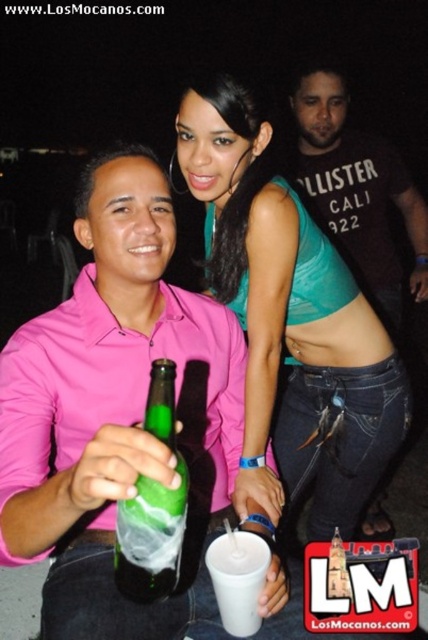
Question: Which point is closer to the camera?

Choices:
 (A) (71, 445)
 (B) (229, 529)
 (C) (163, 531)
 (D) (264, 220)

Answer: (C)

Question: Is matte green glass bottle at center smaller than green glass bottle at center?

Choices:
 (A) no
 (B) yes

Answer: (A)

Question: Among these points, which one is farthest from the camera?

Choices:
 (A) (160, 541)
 (B) (59, 529)

Answer: (B)

Question: Can you confirm if teal fabric top at upper center is positioned to the left of white plastic cup at center?

Choices:
 (A) no
 (B) yes

Answer: (A)

Question: Can you confirm if green glass bottle at center is thinner than white plastic cup at center?

Choices:
 (A) no
 (B) yes

Answer: (B)

Question: Which object is the closest to the green glass bottle at center?

Choices:
 (A) teal fabric top at upper center
 (B) matte green glass bottle at center
 (C) white plastic cup at center

Answer: (C)